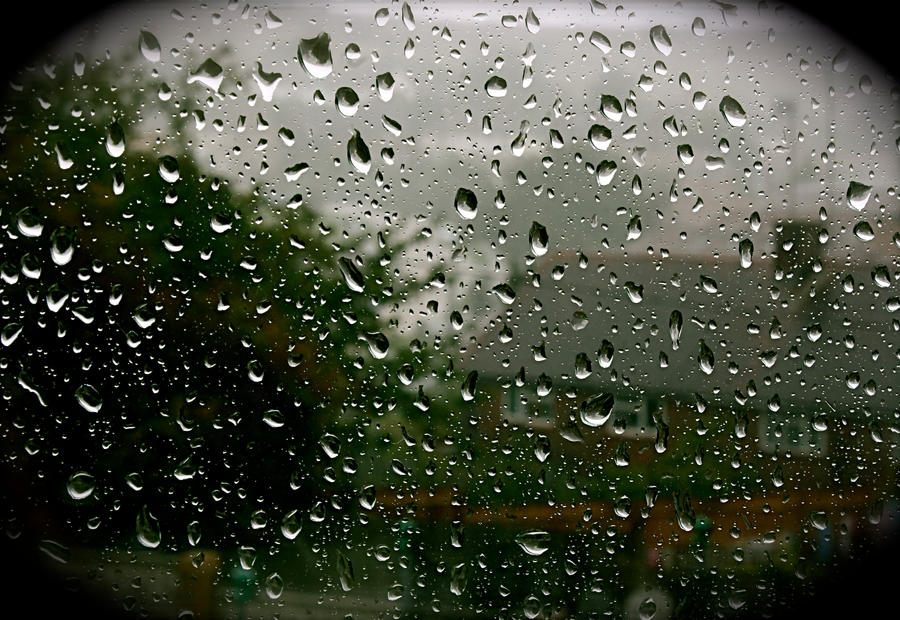
The height and width of the screenshot is (620, 900). In order to click on window on house in this screenshot , I will do `click(786, 434)`, `click(640, 423)`, `click(524, 405)`.